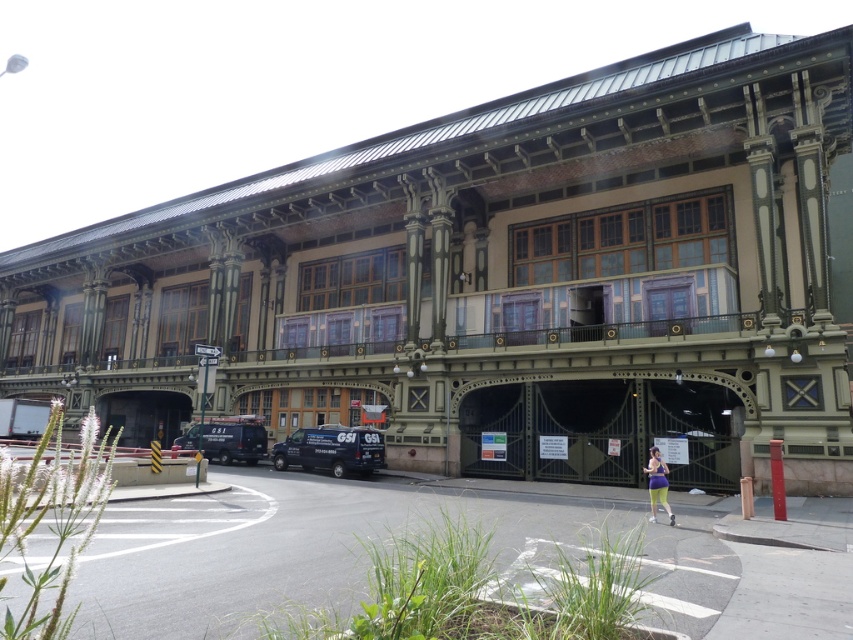
Question: Which point appears farthest from the camera in this image?

Choices:
 (A) (772, 442)
 (B) (312, 444)

Answer: (B)

Question: Which object is farther from the camera taking this photo?

Choices:
 (A) matte black van at lower left
 (B) matte black van at center

Answer: (A)

Question: Which object appears farthest from the camera in this image?

Choices:
 (A) matte black van at center
 (B) red matte pillar at lower right

Answer: (A)

Question: Is matte black van at center smaller than red matte pillar at lower right?

Choices:
 (A) no
 (B) yes

Answer: (A)

Question: Is matte black van at center to the left of red matte pillar at lower right from the viewer's perspective?

Choices:
 (A) no
 (B) yes

Answer: (B)

Question: Can you confirm if matte black van at center is smaller than red matte pillar at lower right?

Choices:
 (A) no
 (B) yes

Answer: (A)